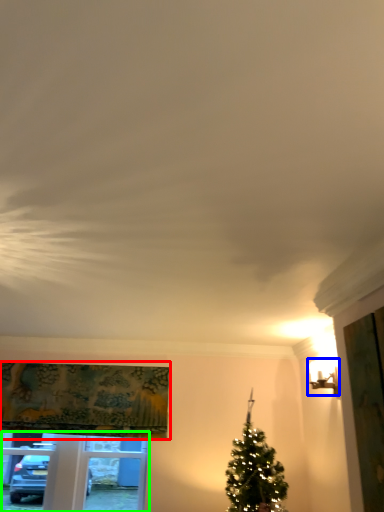
Question: Considering the real-world distances, which object is farthest from curtain (highlighted by a red box)? light fixture (highlighted by a blue box) or window frame (highlighted by a green box)?

Choices:
 (A) light fixture
 (B) window frame

Answer: (A)